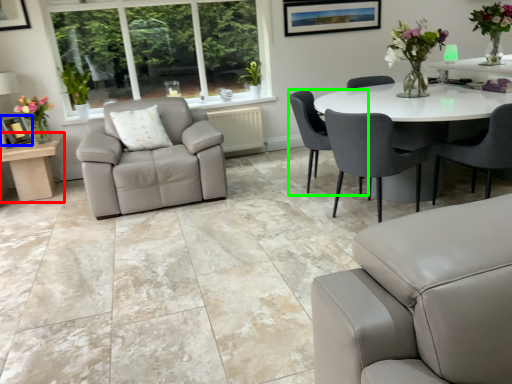
Question: Which object is the closest to the table (highlighted by a red box)? Choose among these: picture frame (highlighted by a blue box) or chair (highlighted by a green box).

Choices:
 (A) picture frame
 (B) chair

Answer: (A)